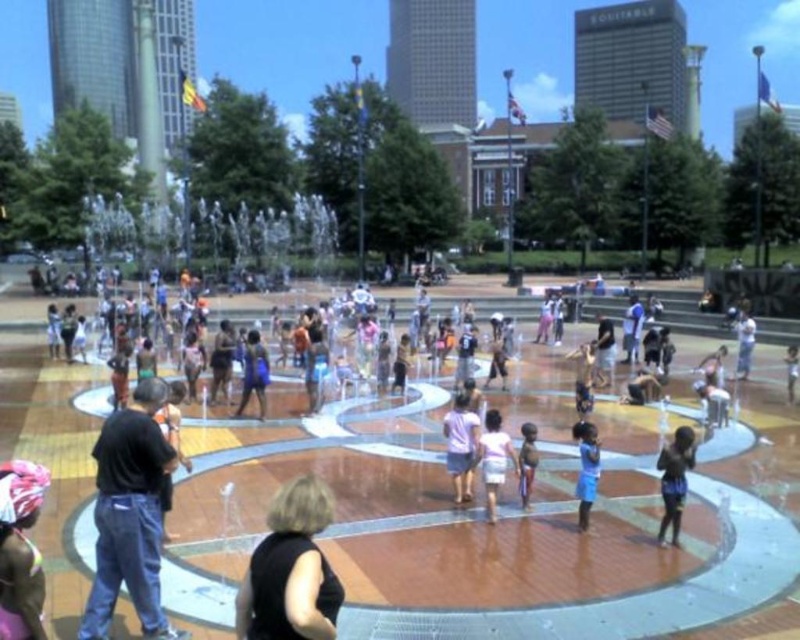
Who is higher up, light blue denim shorts at center or blue fabric shirt at center?

blue fabric shirt at center is higher up.

Is light blue denim shorts at center to the left of blue fabric shirt at center from the viewer's perspective?

In fact, light blue denim shorts at center is to the right of blue fabric shirt at center.

This screenshot has height=640, width=800. In order to click on light blue denim shorts at center in this screenshot , I will do `click(494, 458)`.

Can you confirm if matte pink headscarf at lower left is taller than light brown wooden stick at center?

Indeed, matte pink headscarf at lower left has a greater height compared to light brown wooden stick at center.

Between point (2, 502) and point (521, 467), which one is positioned in front?

Point (2, 502) is more forward.

In order to click on matte pink headscarf at lower left in this screenshot , I will do `click(20, 550)`.

Is light brown wooden stick at center bigger than light blue jersey at center?

Actually, light brown wooden stick at center might be smaller than light blue jersey at center.

Is light brown wooden stick at center wider than light blue jersey at center?

No, light brown wooden stick at center is not wider than light blue jersey at center.

Is point (529, 468) positioned behind point (737, 326)?

No, (529, 468) is closer to viewer.

Find the location of a particular element. This screenshot has width=800, height=640. light brown wooden stick at center is located at coordinates (526, 461).